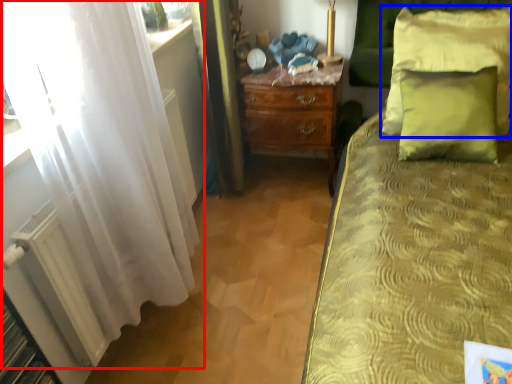
Question: Which point is closer to the camera, curtain (highlighted by a red box) or pillow (highlighted by a blue box)?

Choices:
 (A) curtain
 (B) pillow

Answer: (A)